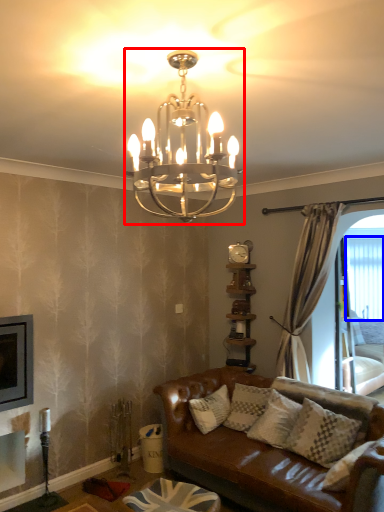
Question: Which of the following is the closest to the observer, lamp (highlighted by a red box) or window screen (highlighted by a blue box)?

Choices:
 (A) lamp
 (B) window screen

Answer: (A)